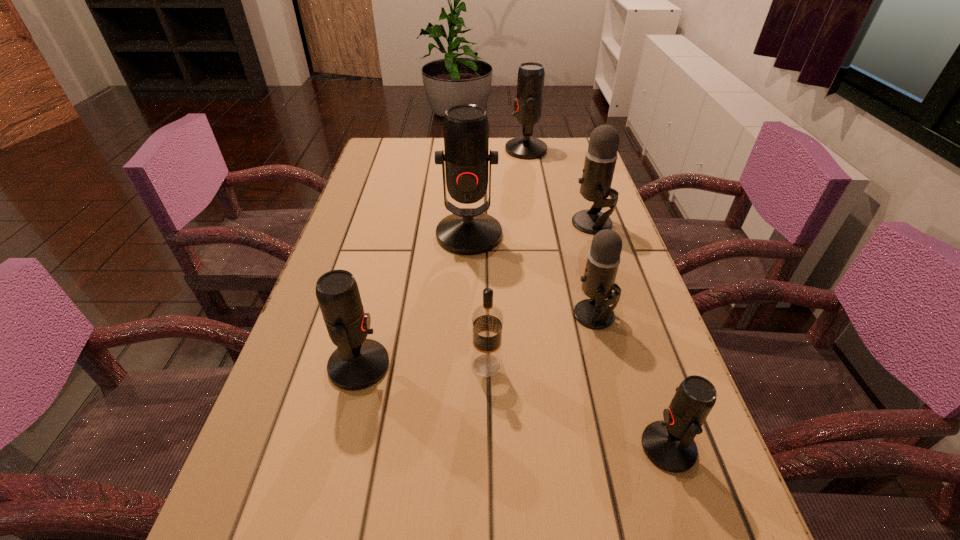
I want to click on the rightmost red microphone, so [x=669, y=444].

Find the location of a particular element. This screenshot has width=960, height=540. the nearest object is located at coordinates (669, 444).

Locate an element on the screen. The width and height of the screenshot is (960, 540). free point located on the side of the second microphone from left to right with the red ring is located at coordinates (465, 389).

The width and height of the screenshot is (960, 540). I want to click on vacant space located 0.090m on the side of the farthest microphone with the red ring, so click(x=478, y=150).

Locate an element on the screen. Image resolution: width=960 pixels, height=540 pixels. vacant area situated on the side of the farthest microphone with the red ring is located at coordinates (449, 150).

The image size is (960, 540). In order to click on vacant space located on the side of the farthest microphone with the red ring in this screenshot , I will do `click(399, 150)`.

Where is `vacant area located 0.060m on the back of the farther gray microphone`? vacant area located 0.060m on the back of the farther gray microphone is located at coordinates (x=585, y=200).

Image resolution: width=960 pixels, height=540 pixels. Identify the location of free space located 0.110m on the side of the leftmost red microphone with the red ring. (447, 366).

Locate an element on the screen. This screenshot has width=960, height=540. free space located on the back of the fourth nearest object is located at coordinates (580, 259).

What are the coordinates of `free spot located on the label of the vodka` in the screenshot? It's located at (345, 365).